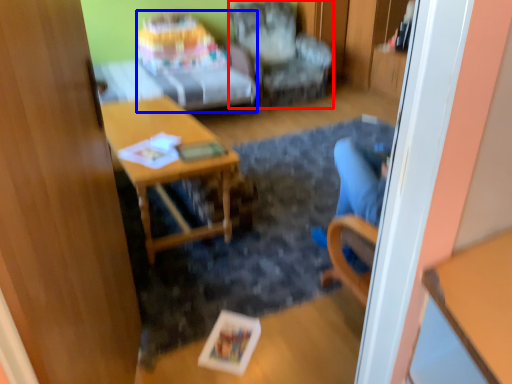
Question: Which object is closer to the camera taking this photo, chair (highlighted by a red box) or studio couch (highlighted by a blue box)?

Choices:
 (A) chair
 (B) studio couch

Answer: (B)